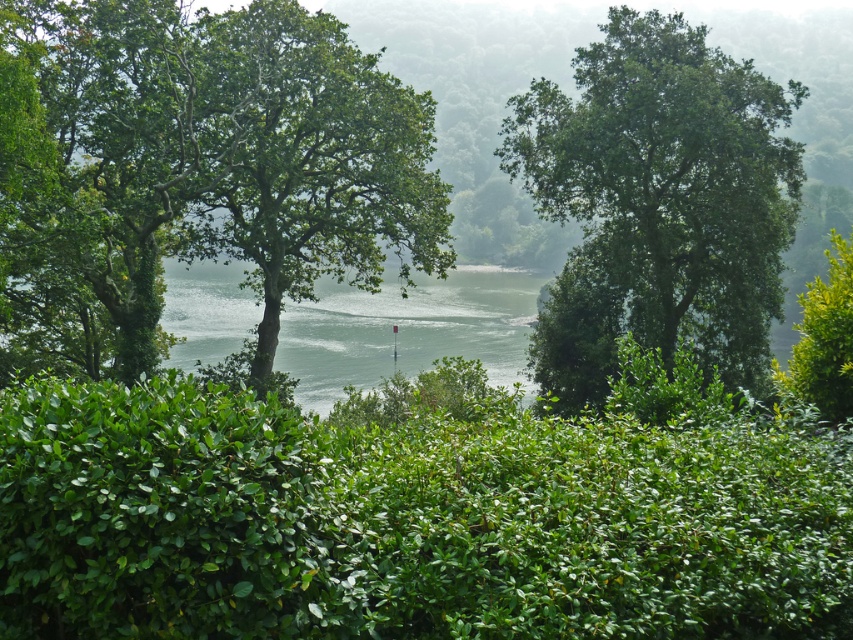
Based on the provided scene description, where is the green leafy tree at upper center located in terms of its 2D coordinates?

The green leafy tree at upper center is located at the 2D coordinates of point (659, 202).

You are standing in the middle of the scene and want to walk towards the green leafy tree at center. Which direction should you move relative to the green leafy hedge at center?

To reach the green leafy tree at center from the middle of the scene, you should move to the left of the green leafy hedge at center since the hedge is positioned to the right of the tree.

You are a gardener planning to trim both the green leafy hedge at center and the green leafy tree at center. Which one will require a ladder to reach the top?

The green leafy tree at center is taller than the green leafy hedge at center, so you will need a ladder to reach the top of the green leafy tree at center.